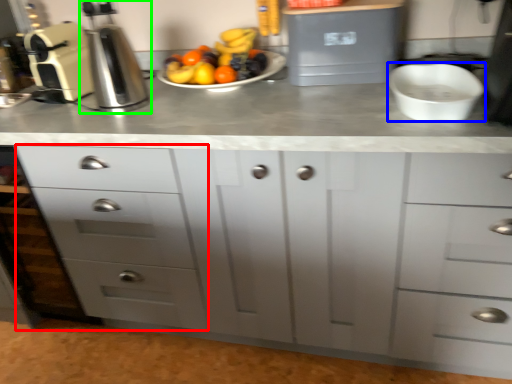
Question: Estimate the real-world distances between objects in this image. Which object is closer to drawer (highlighted by a red box), mixing bowl (highlighted by a blue box) or coffee machine (highlighted by a green box)?

Choices:
 (A) mixing bowl
 (B) coffee machine

Answer: (B)